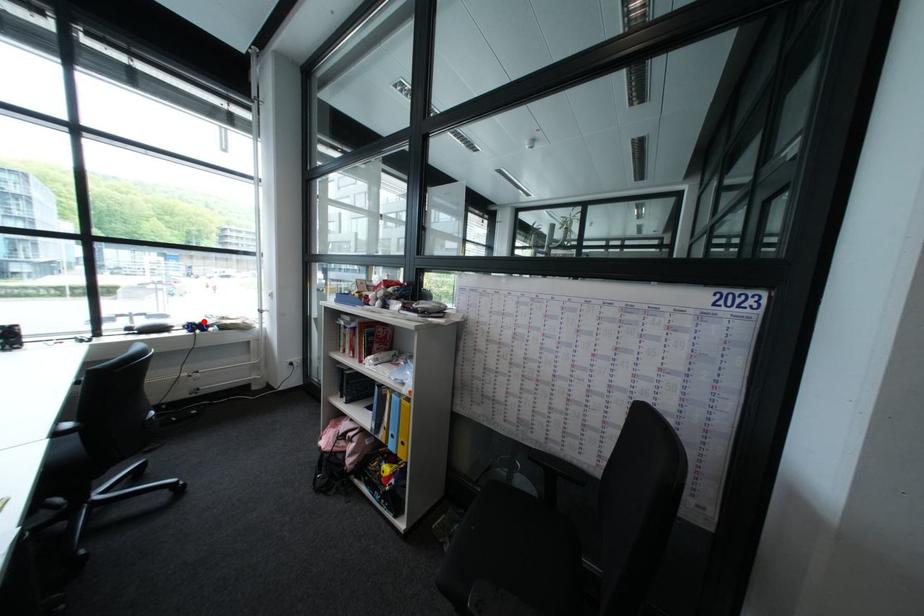
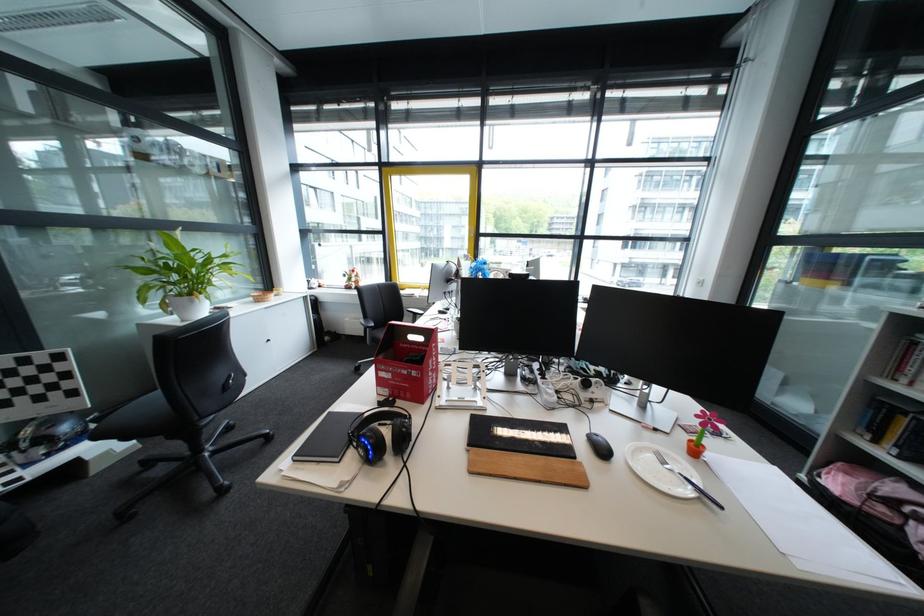
Question: I am providing you with two images of the same scene from different viewpoints. A red point is marked on the first image. Is the red point's position out of view in image 2?

Choices:
 (A) Yes
 (B) No

Answer: (A)